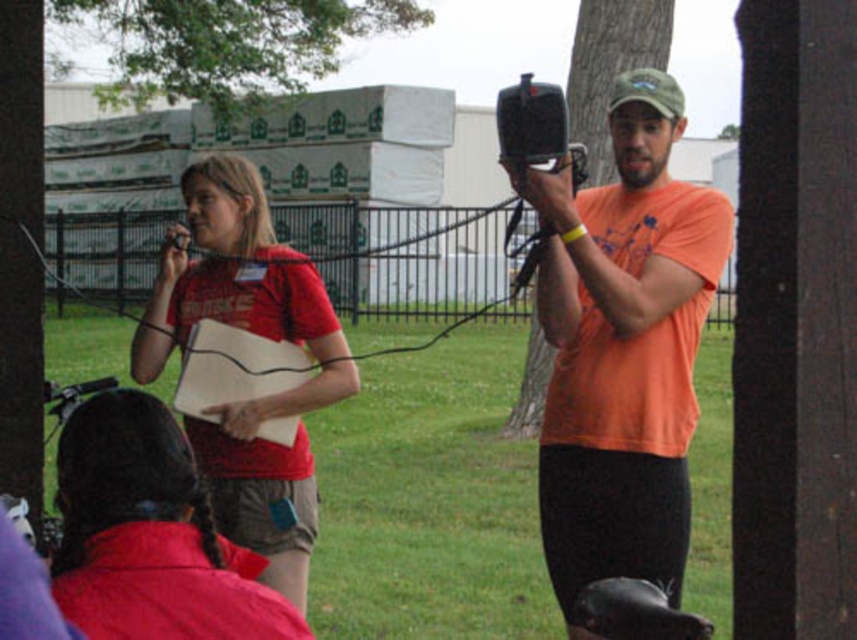
Question: Can you confirm if matte red shirt at center is positioned to the left of matte red jacket at lower left?

Choices:
 (A) yes
 (B) no

Answer: (A)

Question: Among these objects, which one is farthest from the camera?

Choices:
 (A) green leafy tree at upper center
 (B) matte red jacket at lower left
 (C) brown textured tree trunk at upper center
 (D) orange matte t-shirt at center

Answer: (A)

Question: Does green leafy tree at upper center appear on the right side of brown textured tree trunk at upper center?

Choices:
 (A) yes
 (B) no

Answer: (B)

Question: Which of the following is the closest to the observer?

Choices:
 (A) green leafy tree at upper center
 (B) orange matte t-shirt at center

Answer: (B)

Question: Among these points, which one is nearest to the camera?

Choices:
 (A) (550, 348)
 (B) (169, 301)
 (C) (675, 252)

Answer: (C)

Question: Does matte red jacket at lower left have a smaller size compared to green leafy tree at upper center?

Choices:
 (A) no
 (B) yes

Answer: (B)